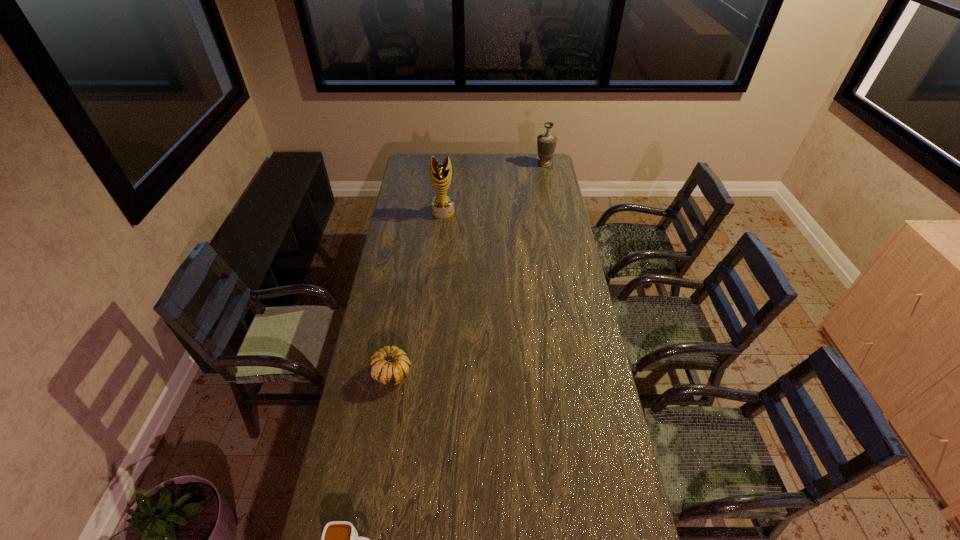
I want to click on vacant space that's between the rightmost object and the tallest object, so click(493, 188).

Identify the location of free spot between the third shortest object and the third nearest object. (493, 188).

Choose which object is the nearest neighbor to the second nearest object. Please provide its 2D coordinates. Your answer should be formatted as a tuple, i.e. [(x, y)], where the tuple contains the x and y coordinates of a point satisfying the conditions above.

[(339, 539)]

I want to click on object that is the second closest to the cup, so click(x=442, y=205).